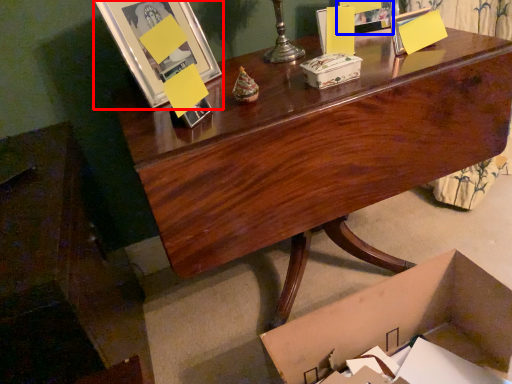
Question: Among these objects, which one is nearest to the camera, picture frame (highlighted by a red box) or picture frame (highlighted by a blue box)?

Choices:
 (A) picture frame
 (B) picture frame

Answer: (A)